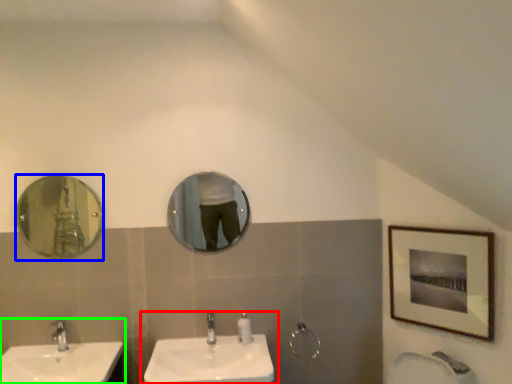
Question: Which is nearer to the sink (highlighted by a red box)? mirror (highlighted by a blue box) or sink (highlighted by a green box).

Choices:
 (A) mirror
 (B) sink

Answer: (B)